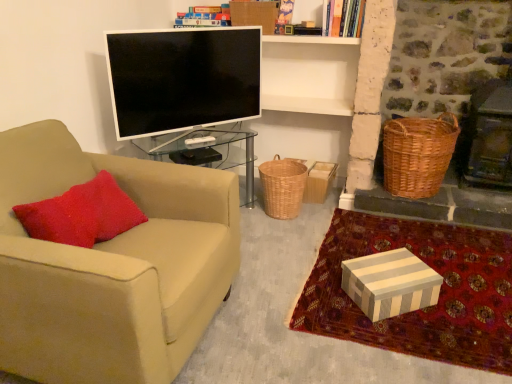
Find the location of a particular element. The height and width of the screenshot is (384, 512). white striped fabric at lower right is located at coordinates (425, 308).

Describe the element at coordinates (111, 266) in the screenshot. I see `beige fabric chair at left` at that location.

Describe the element at coordinates (343, 18) in the screenshot. I see `hardcover book at upper center` at that location.

What do you see at coordinates (418, 154) in the screenshot? The width and height of the screenshot is (512, 384). I see `woven brown picnic basket at right` at bounding box center [418, 154].

Identify the location of white striped fabric at lower right. Image resolution: width=512 pixels, height=384 pixels. (425, 308).

Choose the correct answer: Is flat screen tv at center inside striped cardboard box at lower right or outside it?

flat screen tv at center is spatially situated outside striped cardboard box at lower right.

What's the angular difference between flat screen tv at center and striped cardboard box at lower right's facing directions?

They differ by 15.4 degrees in their facing directions.

Identify the location of television on the left of the striped cardboard box at lower right. This screenshot has height=384, width=512. (183, 79).

How much distance is there between flat screen tv at center and striped cardboard box at lower right?

1.28 meters.

The image size is (512, 384). I want to click on picnic basket directly beneath the flat screen tv at center (from a real-world perspective), so click(418, 154).

Consider the image. From a real-world perspective, which object stands above the other?

flat screen tv at center, from a real-world perspective.

Between woven brown picnic basket at right and flat screen tv at center, which one appears on the left side from the viewer's perspective?

From the viewer's perspective, flat screen tv at center appears more on the left side.

Is striped cardboard box at lower right wider or thinner than flat screen tv at center?

Clearly, striped cardboard box at lower right has more width compared to flat screen tv at center.

Which of these two, striped cardboard box at lower right or flat screen tv at center, stands shorter?

striped cardboard box at lower right is shorter.

From a real-world perspective, is striped cardboard box at lower right physically located above or below flat screen tv at center?

striped cardboard box at lower right is below flat screen tv at center.

From the image's perspective, which object appears higher, striped cardboard box at lower right or flat screen tv at center?

flat screen tv at center.

Between white striped fabric at lower right and woven brown basket at center, which one has smaller width?

woven brown basket at center.

Is woven brown basket at center located within white striped fabric at lower right?

No, woven brown basket at center is located outside of white striped fabric at lower right.

Is the depth of white striped fabric at lower right less than that of woven brown basket at center?

Yes, the depth of white striped fabric at lower right is less than that of woven brown basket at center.

Could you tell me if hardcover book at upper center is turned towards white striped fabric at lower right?

No, hardcover book at upper center is not oriented towards white striped fabric at lower right.

In the image, there is a white striped fabric at lower right. At what (x,y) coordinates should I click in order to perform the action: click on book above it (from the image's perspective). Please return your answer as a coordinate pair (x, y). Looking at the image, I should click on click(x=343, y=18).

Which object is closer to the camera, hardcover book at upper center or white striped fabric at lower right?

Positioned in front is white striped fabric at lower right.

In the scene shown: Can you confirm if hardcover book at upper center is taller than white striped fabric at lower right?

Yes, hardcover book at upper center is taller than white striped fabric at lower right.

From the image's perspective, is flat screen tv at center above or below woven brown basket at center?

flat screen tv at center is situated higher than woven brown basket at center in the image.

Is flat screen tv at center facing away from woven brown basket at center?

flat screen tv at center does not have its back to woven brown basket at center.

Considering the relative sizes of flat screen tv at center and woven brown basket at center in the image provided, is flat screen tv at center smaller than woven brown basket at center?

No.

Where is `basket below the flat screen tv at center (from the image's perspective)`? The height and width of the screenshot is (384, 512). basket below the flat screen tv at center (from the image's perspective) is located at coordinates (282, 187).

From a real-world perspective, is striped cardboard box at lower right above or below woven brown picnic basket at right?

Clearly, from a real-world perspective, striped cardboard box at lower right is below woven brown picnic basket at right.

Which object is positioned more to the left, striped cardboard box at lower right or woven brown picnic basket at right?

striped cardboard box at lower right.

This screenshot has width=512, height=384. In order to click on television on the left side of striped cardboard box at lower right in this screenshot , I will do `click(183, 79)`.

Where is `picnic basket that appears below the flat screen tv at center (from a real-world perspective)`? picnic basket that appears below the flat screen tv at center (from a real-world perspective) is located at coordinates (418, 154).

Looking at the image, which one is located further to striped cardboard box at lower right, flat screen tv at center or white striped fabric at lower right?

flat screen tv at center.

Which object lies nearer to the anchor point hardcover book at upper center, woven brown basket at center or woven brown picnic basket at right?

woven brown picnic basket at right lies closer to hardcover book at upper center than the other object.

Which object lies nearer to the anchor point woven brown basket at center, flat screen tv at center or beige fabric chair at left?

flat screen tv at center.

Considering their positions, is woven brown basket at center positioned further to woven brown picnic basket at right than hardcover book at upper center?

hardcover book at upper center is positioned further to the anchor woven brown picnic basket at right.

Based on their spatial positions, is woven brown picnic basket at right or flat screen tv at center closer to hardcover book at upper center?

The object closer to hardcover book at upper center is woven brown picnic basket at right.

Looking at the image, which one is located further to white striped fabric at lower right, woven brown basket at center or striped cardboard box at lower right?

Among the two, woven brown basket at center is located further to white striped fabric at lower right.

Considering their positions, is flat screen tv at center positioned further to white striped fabric at lower right than striped cardboard box at lower right?

flat screen tv at center.

From the image, which object appears to be nearer to woven brown picnic basket at right, white striped fabric at lower right or striped cardboard box at lower right?

Among the two, white striped fabric at lower right is located nearer to woven brown picnic basket at right.

Where is `television between beige fabric chair at left and white striped fabric at lower right`? Image resolution: width=512 pixels, height=384 pixels. television between beige fabric chair at left and white striped fabric at lower right is located at coordinates (183, 79).

At what (x,y) coordinates should I click in order to perform the action: click on television situated between beige fabric chair at left and woven brown picnic basket at right from left to right. Please return your answer as a coordinate pair (x, y). Image resolution: width=512 pixels, height=384 pixels. Looking at the image, I should click on (183, 79).

In order to click on television between beige fabric chair at left and striped cardboard box at lower right in the horizontal direction in this screenshot , I will do `click(183, 79)`.

Find the location of a particular element. The image size is (512, 384). picnic basket between hardcover book at upper center and woven brown basket at center in the vertical direction is located at coordinates (418, 154).